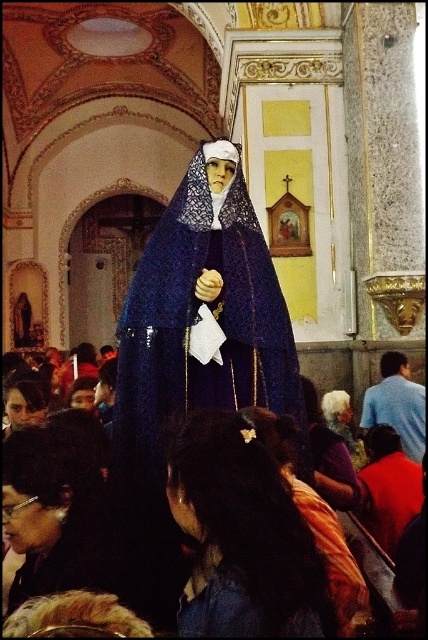
Does dark brown hair at center come in front of blue shirt at right?

Yes, dark brown hair at center is closer to the viewer.

In the scene shown: Can you confirm if dark brown hair at center is thinner than blue shirt at right?

Indeed, dark brown hair at center has a lesser width compared to blue shirt at right.

The height and width of the screenshot is (640, 428). Identify the location of dark brown hair at center. (243, 536).

Does white fabric headscarf at center have a greater width compared to gray hair at center?

Yes.

Does white fabric headscarf at center have a smaller size compared to gray hair at center?

Incorrect, white fabric headscarf at center is not smaller in size than gray hair at center.

This screenshot has width=428, height=640. What are the coordinates of `white fabric headscarf at center` in the screenshot? It's located at (329, 456).

Between dark brown hair at center and white fabric headscarf at center, which one has more height?

Standing taller between the two is white fabric headscarf at center.

Is point (177, 506) positioned in front of point (360, 497)?

Yes, point (177, 506) is closer to viewer.

The width and height of the screenshot is (428, 640). Identify the location of dark brown hair at center. (243, 536).